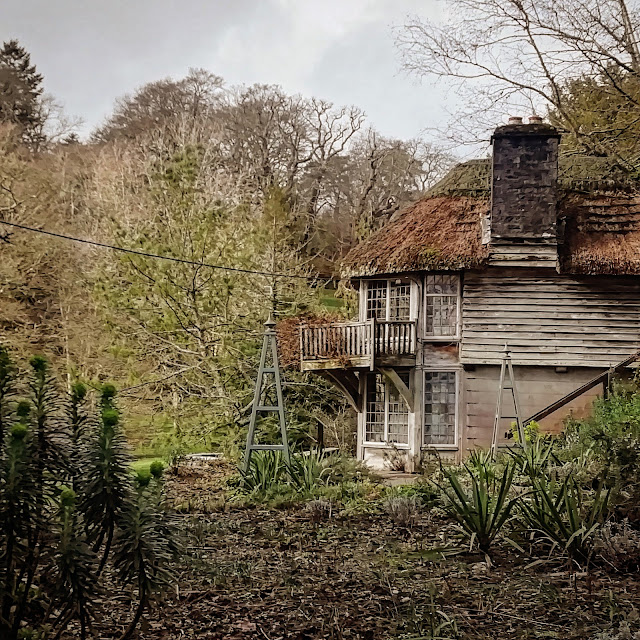
Image resolution: width=640 pixels, height=640 pixels. In order to click on chimney in this screenshot , I will do `click(525, 192)`.